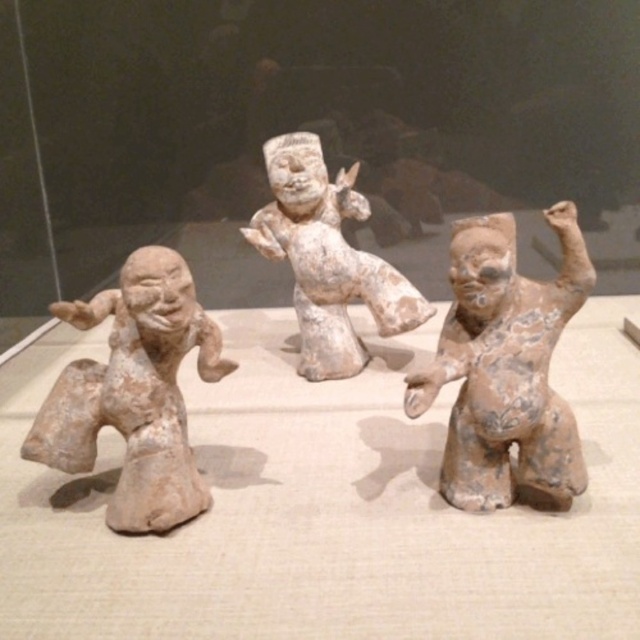
You are a museum curator arranging an exhibit. You need to place a label next to the earthy clay figure at center and the matte clay figure at left. Which figure requires a larger label size to match its scale?

The earthy clay figure at center requires a larger label size because it is larger in size than the matte clay figure at left.

Is the point at coordinate (506, 365) located on the earthy clay figure at center?

Yes, the point at coordinate (506, 365) is located on the earthy clay figure at center.

What are the coordinates of the earthy clay figure at center?

The earthy clay figure at center is at coordinates (506, 365).